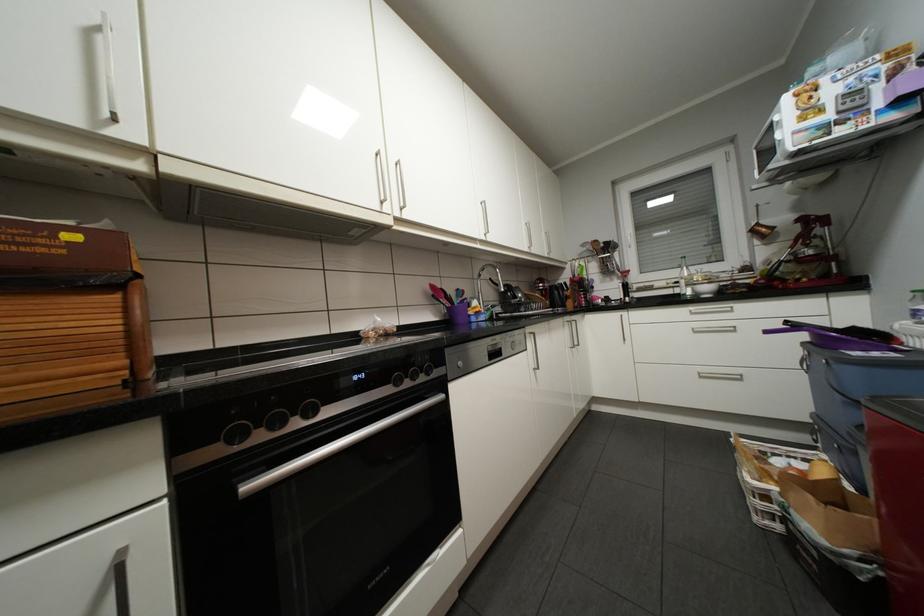
This screenshot has height=616, width=924. What do you see at coordinates (684, 278) in the screenshot?
I see `the glass bottle` at bounding box center [684, 278].